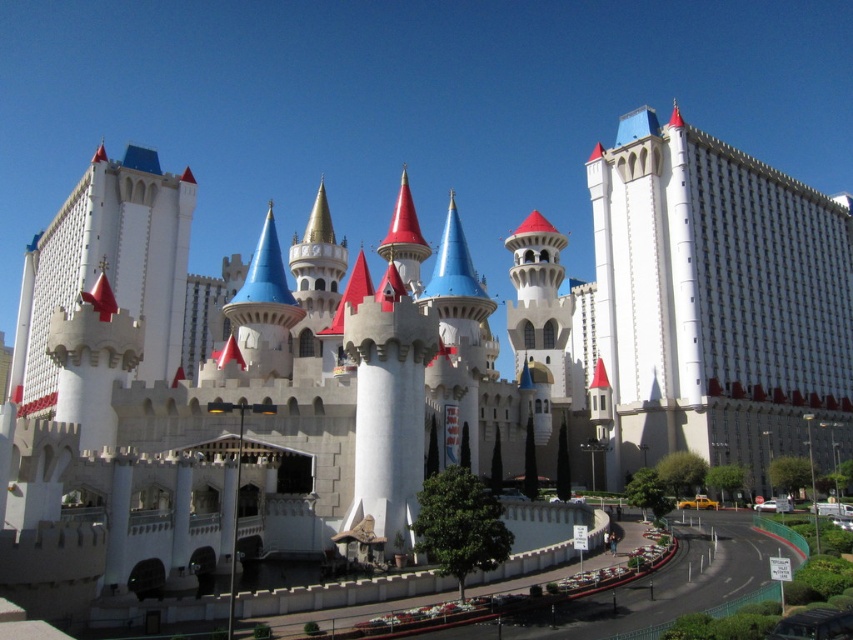
Based on the photo, who is positioned more to the right, white smooth building at right or white stone castle at left?

From the viewer's perspective, white smooth building at right appears more on the right side.

How distant is white smooth building at right from white stone castle at left?

white smooth building at right and white stone castle at left are 239.04 feet apart from each other.

You are a GUI agent. You are given a task and a screenshot of the screen. Output one action in this format:
    pyautogui.click(x=<x>, y=<y>)
    Task: Click on the white smooth building at right
    
    Given the screenshot: What is the action you would take?
    pyautogui.click(x=717, y=300)

Locate an element on the screen. The height and width of the screenshot is (640, 853). white smooth building at right is located at coordinates (717, 300).